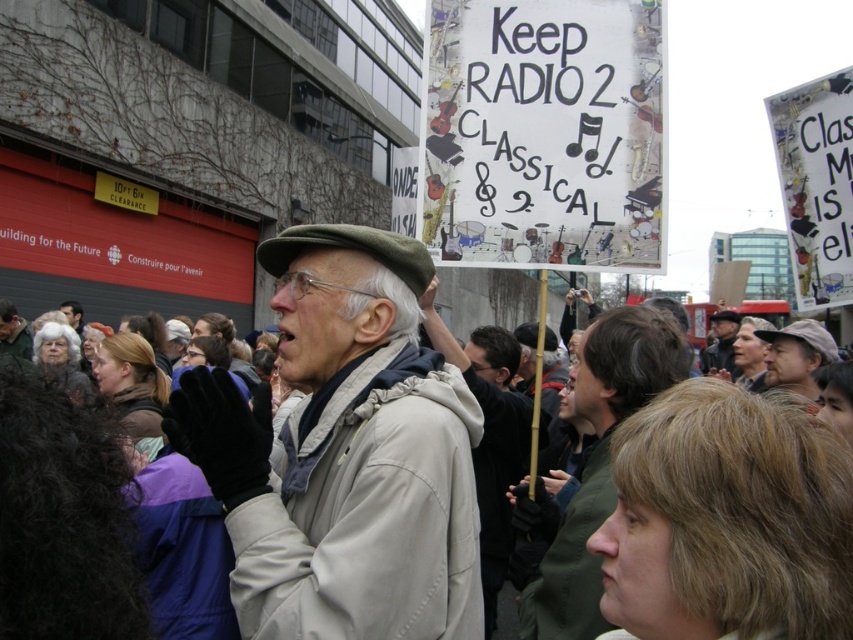
You are a photographer trying to capture a photo of the protest scene. You notice the dark brown leather jacket at center and the dark gray knit cap at upper center. Which object should you focus on first if you want to include both in your frame without moving the camera?

You should focus on the dark brown leather jacket at center first because it is positioned under the dark gray knit cap at upper center, meaning it is lower in the frame. By focusing on the lower object first, you can ensure both are in the same plane of focus without needing to adjust the camera position.